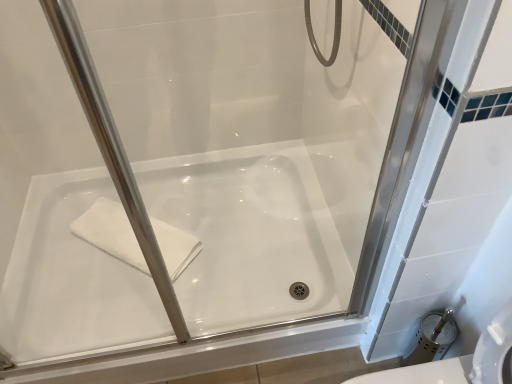
What do you see at coordinates (110, 232) in the screenshot?
I see `white soft towel at lower left` at bounding box center [110, 232].

Where is `white soft towel at lower left`? The height and width of the screenshot is (384, 512). white soft towel at lower left is located at coordinates (110, 232).

I want to click on white soft towel at lower left, so click(x=110, y=232).